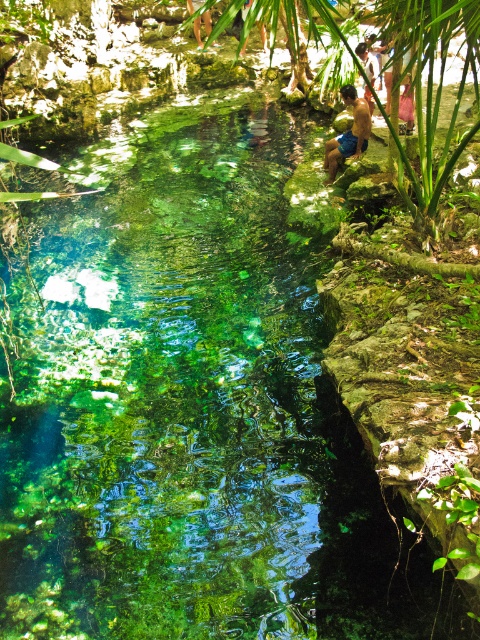
You are standing at the edge of the pool and want to hand a towel to the smooth skin person at upper center. The brown textured shirt at upper center is in your way. Can you reach the person without moving the shirt?

The brown textured shirt at upper center is further to the viewer than smooth skin person at upper center, so the shirt is closer to you. This means the shirt is blocking your direct line of sight to the person. You would need to move the shirt out of the way or find another path to reach the smooth skin person at upper center.

You are a photographer planning to take a portrait of the person in the scene. You want to ensure the blue denim shorts at upper right and the brown textured shirt at upper center are both visible. Based on their positions, which clothing item should you focus on first to ensure it stays in frame?

The blue denim shorts at upper right is below the brown textured shirt at upper center. To ensure both are visible, focus on framing the brown textured shirt at upper center first since it is higher up, allowing the shorts to naturally fall into the lower part of the frame.